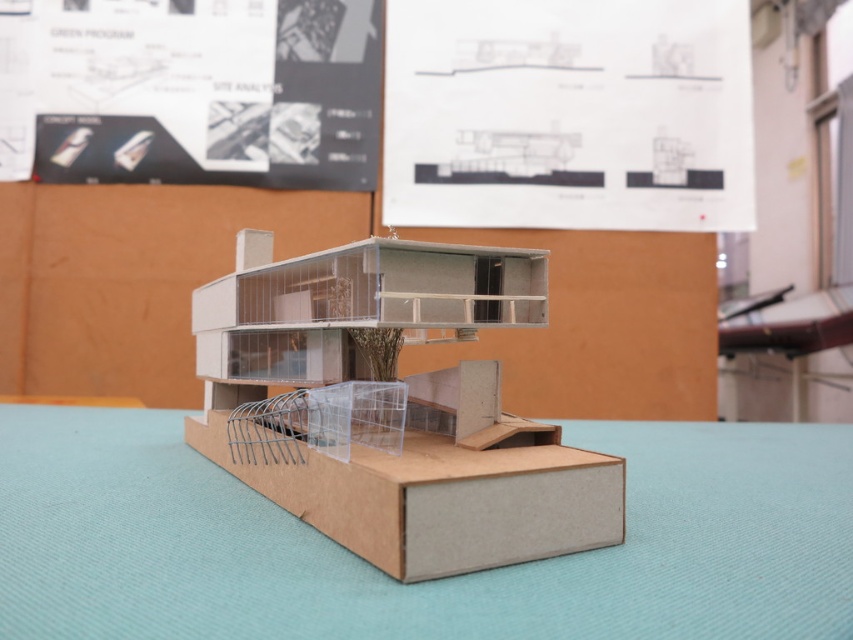
You are an architect examining the miniature model. You need to place a new decorative item on the cardboard box at center and the brown cardboard box at lower center. Which box will appear closer to you when viewed from the front?

The cardboard box at center will appear closer to you because it is further to the viewer than the brown cardboard box at lower center, meaning it is positioned nearer in the scene.

You are organizing a model house display and need to ensure that the cardboard box at center and the brown cardboard box at lower center are arranged according to the model design. Based on the scene, which box should be placed higher in elevation?

The cardboard box at center should be placed higher in elevation since it is located above the brown cardboard box at lower center according to the model design.

You are a small toy car trying to drive from the edge of the image to the brown cardboard table at center. However, there is a brown cardboard box at lower center in the way. Can you reach the table without going under the box?

The brown cardboard table at center is positioned under the brown cardboard box at lower center, so the toy car cannot reach the table without passing under the box.